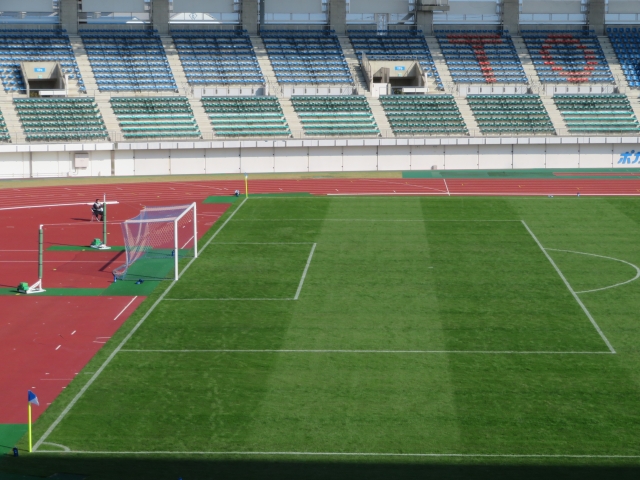
You are a GUI agent. You are given a task and a screenshot of the screen. Output one action in this format:
    pyautogui.click(x=<x>, y=<y>)
    Task: Click on the entry
    The width and height of the screenshot is (640, 480).
    Given the screenshot: What is the action you would take?
    pyautogui.click(x=47, y=82)